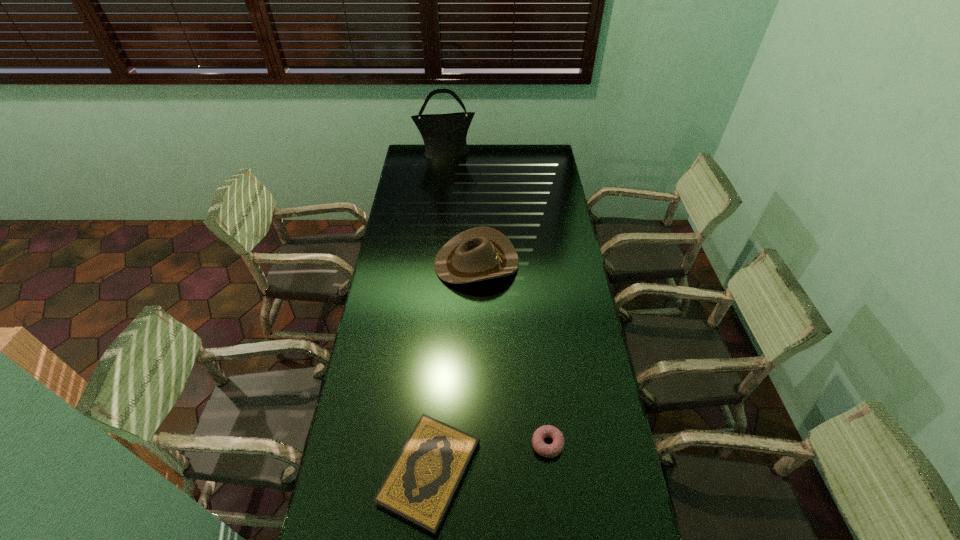
I want to click on shoulder bag, so click(444, 135).

I want to click on the farthest object, so click(x=444, y=135).

Where is `cowboy hat`? Image resolution: width=960 pixels, height=540 pixels. cowboy hat is located at coordinates (480, 253).

Locate an element on the screen. The image size is (960, 540). the third shortest object is located at coordinates (480, 253).

Image resolution: width=960 pixels, height=540 pixels. In order to click on doughnut in this screenshot , I will do `click(552, 450)`.

This screenshot has width=960, height=540. Identify the location of hardback book. (420, 487).

This screenshot has height=540, width=960. What are the coordinates of `free space located on the right of the farthest object` in the screenshot? It's located at (533, 153).

Where is `free location located with a star on the front of the cowboy hat`? Image resolution: width=960 pixels, height=540 pixels. free location located with a star on the front of the cowboy hat is located at coordinates [x=573, y=263].

Where is `vacant space located 0.050m on the left of the doughnut`? The width and height of the screenshot is (960, 540). vacant space located 0.050m on the left of the doughnut is located at coordinates (515, 444).

Find the location of `free spot located on the back of the shortest object`. free spot located on the back of the shortest object is located at coordinates (437, 382).